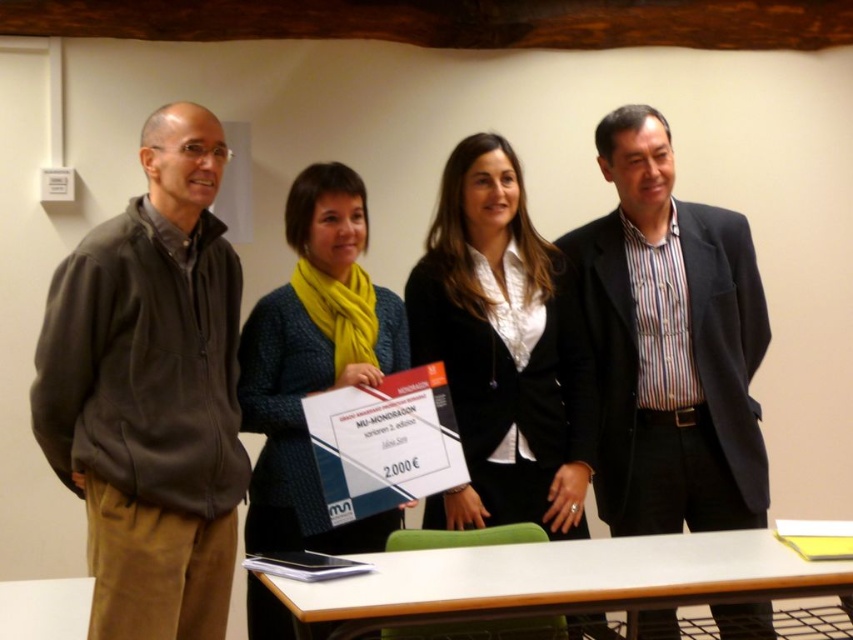
You are organizing a photoshoot and need to arrange the black matte blazer at center and the knitted wool scarf at center in a way that follows the current scene. Which item should be placed to the right of the other?

The black matte blazer at center should be placed to the right of the knitted wool scarf at center because the black matte blazer at center is positioned on the right side of knitted wool scarf at center in the scene.

You are standing in the room and want to hand a document to both the person wearing the dark gray fleece jacket at left and the person wearing the black matte blazer at center. Which person should you approach first to ensure you can reach them without moving past the other?

You should approach the dark gray fleece jacket at left first since it is closer to you than the black matte blazer at center, so you can reach them without needing to move past the other person.

You are an assistant organizing a formal event and need to ensure proper attire coordination. You see the black matte blazer at center and the knitted wool scarf at center. Which item is positioned higher on the person wearing them?

The black matte blazer at center is located above the knitted wool scarf at center, so the blazer is positioned higher on the person wearing them.